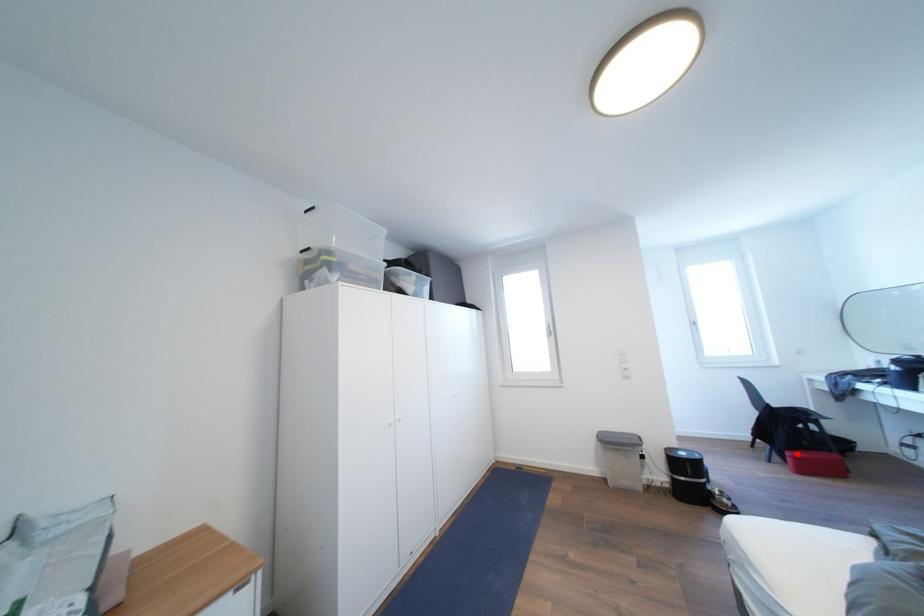
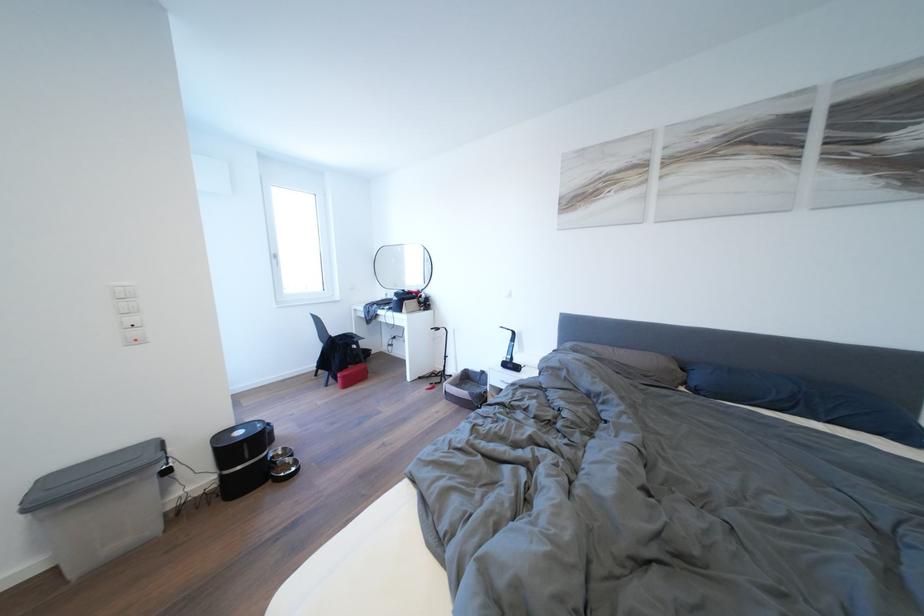
In the second image, find the point that corresponds to the highlighted location in the first image.

(348, 376)